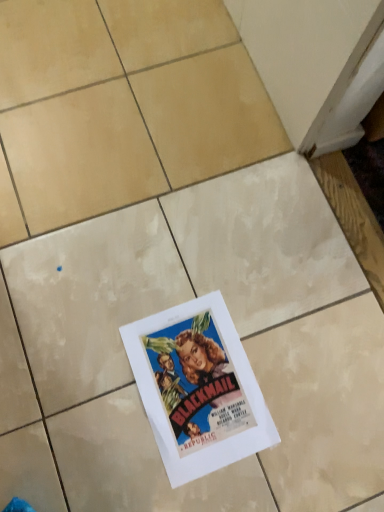
Where is `blank space to the left of matte paper poster at center`? blank space to the left of matte paper poster at center is located at coordinates (81, 371).